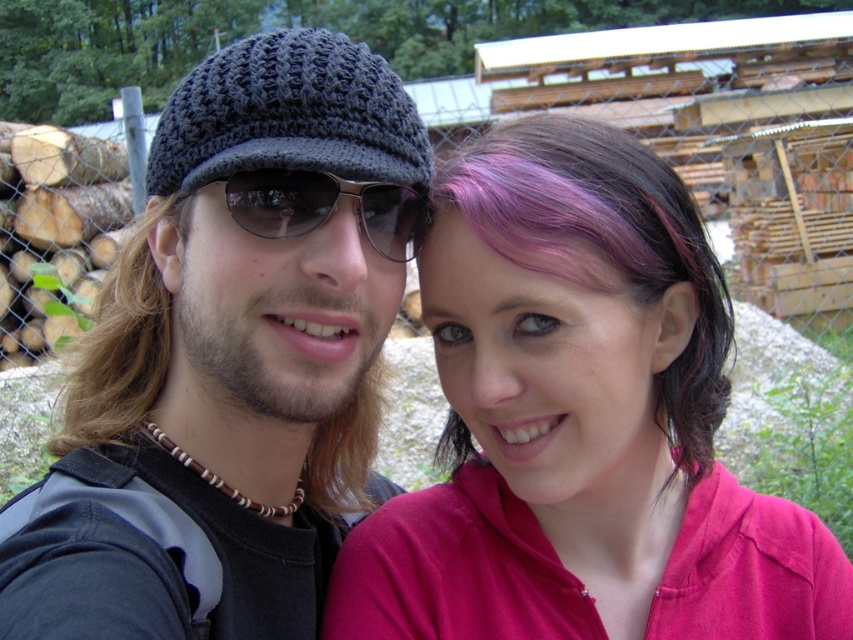
Question: Is knitted dark gray beanie at left to the left of brownwoollyhat at left from the viewer's perspective?

Choices:
 (A) yes
 (B) no

Answer: (B)

Question: Which is nearer to the purple dyed hair at upper right?

Choices:
 (A) pink hair at center
 (B) knitted dark gray beanie at left
 (C) sunglasses at center
 (D) brownwoollyhat at left

Answer: (A)

Question: Does purple dyed hair at upper right have a lesser width compared to sunglasses at center?

Choices:
 (A) no
 (B) yes

Answer: (A)

Question: Which of the following is the farthest from the observer?

Choices:
 (A) purple dyed hair at upper right
 (B) sunglasses at center
 (C) knitted dark gray beanie at left
 (D) crochet knit cap at left

Answer: (D)

Question: Based on their relative distances, which object is nearer to the purple dyed hair at upper right?

Choices:
 (A) sunglasses at center
 (B) crochet knit cap at left
 (C) brownwoollyhat at left
 (D) knitted dark gray beanie at left

Answer: (A)

Question: Is knitted dark gray beanie at left further to the viewer compared to crochet knit cap at left?

Choices:
 (A) no
 (B) yes

Answer: (A)